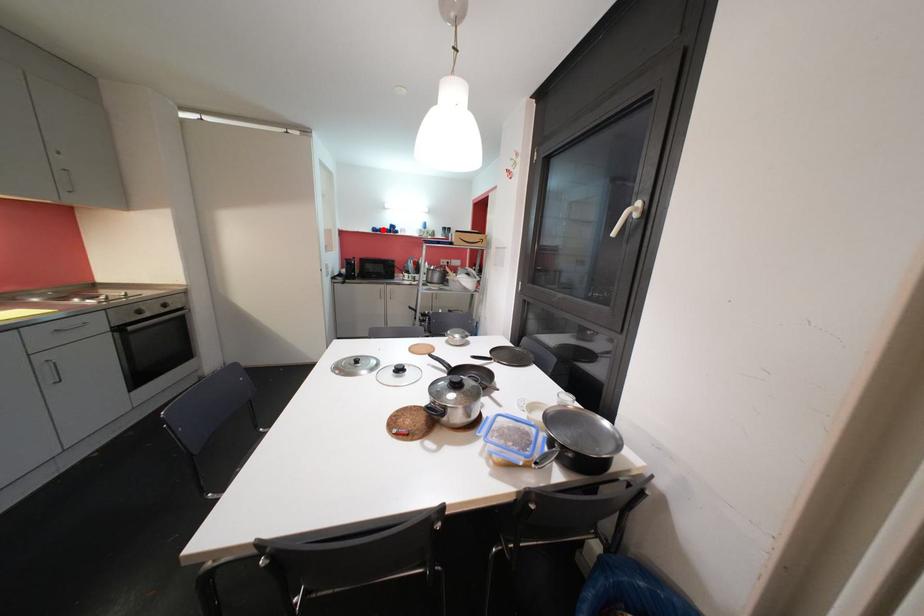
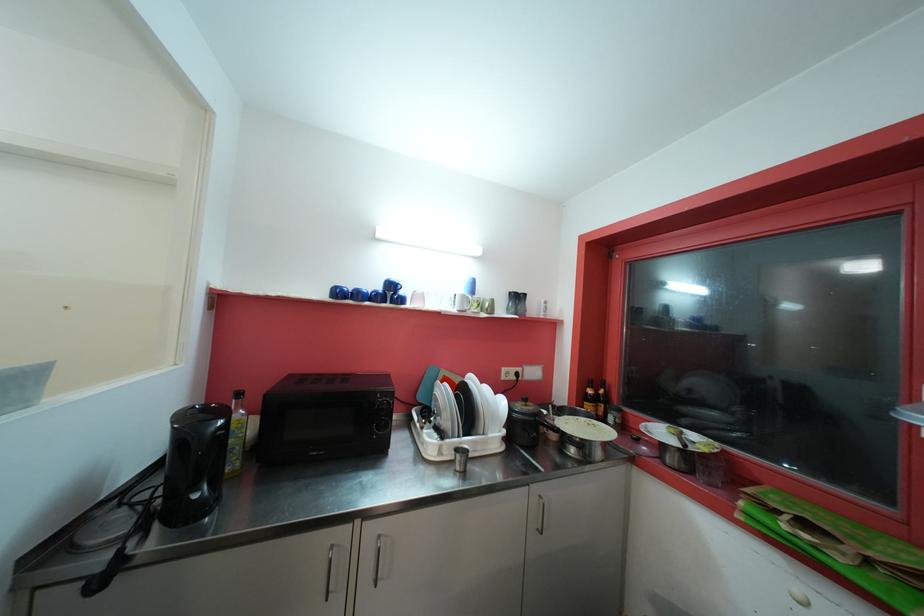
Question: I am providing you with two images of the same scene from different viewpoints. A red point is marked on the first image. Is the red point's position out of view in image 2?

Choices:
 (A) Yes
 (B) No

Answer: (B)